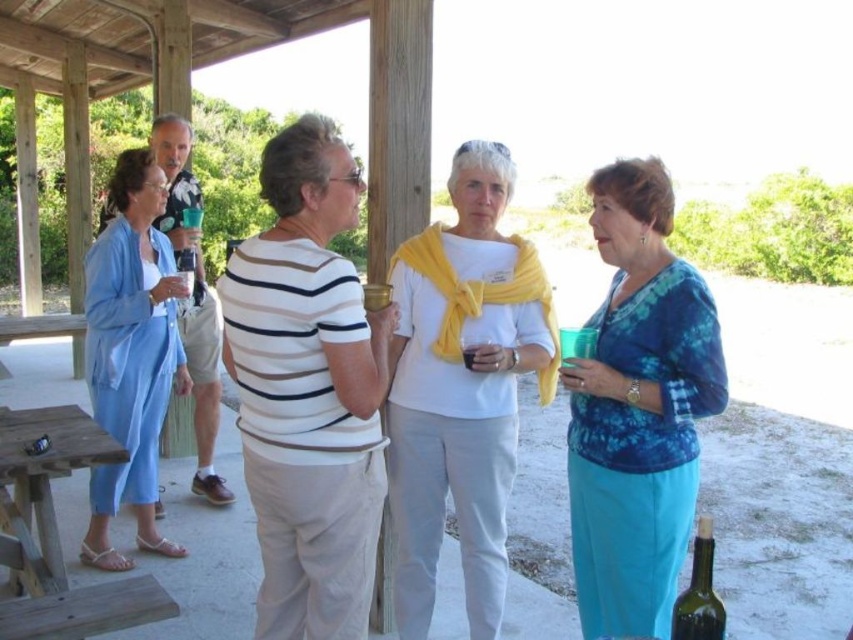
Is point (311, 154) positioned after point (703, 570)?

Yes, point (311, 154) is behind point (703, 570).

Can you confirm if white striped shirt at center is positioned below green glass bottle at lower right?

No.

In the scene shown: Measure the distance between white striped shirt at center and camera.

1.93 meters

The image size is (853, 640). What are the coordinates of `white striped shirt at center` in the screenshot? It's located at (308, 390).

Can you confirm if white matte scarf at center is shorter than translucent glass at center?

In fact, white matte scarf at center may be taller than translucent glass at center.

Between white matte scarf at center and translucent glass at center, which one appears on the left side from the viewer's perspective?

white matte scarf at center is more to the left.

What do you see at coordinates (462, 388) in the screenshot? The width and height of the screenshot is (853, 640). I see `white matte scarf at center` at bounding box center [462, 388].

The height and width of the screenshot is (640, 853). I want to click on white matte scarf at center, so click(462, 388).

Does point (618, 291) lie behind point (467, 368)?

No, it is in front of (467, 368).

Describe the element at coordinates (637, 410) in the screenshot. This screenshot has width=853, height=640. I see `blue tie-dye blouse at center` at that location.

Image resolution: width=853 pixels, height=640 pixels. Describe the element at coordinates (637, 410) in the screenshot. I see `blue tie-dye blouse at center` at that location.

The image size is (853, 640). In order to click on blue tie-dye blouse at center in this screenshot , I will do `click(637, 410)`.